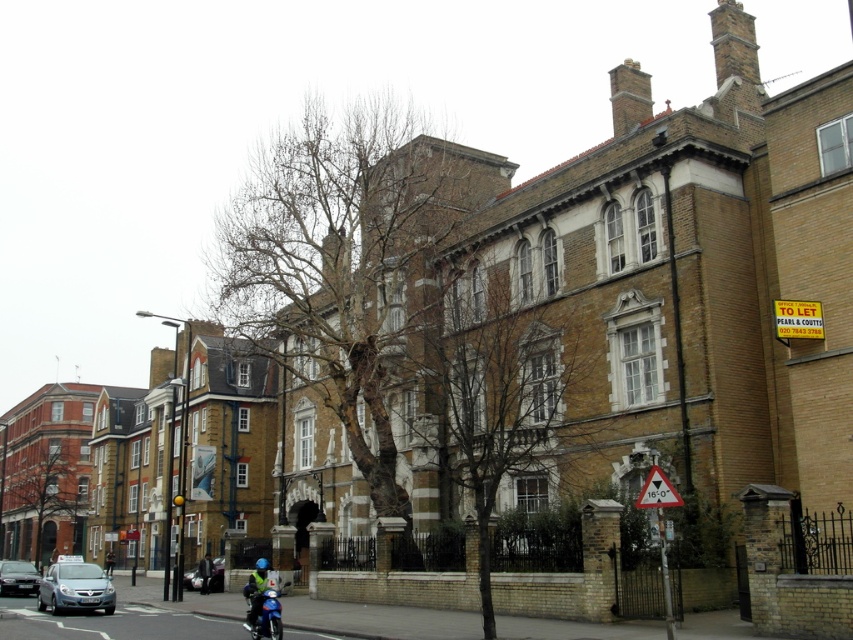
Does metal triangular sign at center have a larger size compared to dark gray suit at center?

No.

Between metal triangular sign at center and dark gray suit at center, which one has more height?

dark gray suit at center is taller.

Which is behind, point (646, 481) or point (201, 576)?

Point (201, 576)

At what (x,y) coordinates should I click in order to perform the action: click on metal triangular sign at center. Please return your answer as a coordinate pair (x, y). Looking at the image, I should click on (657, 490).

Looking at this image, is silver metallic car at lower left closer to camera compared to metal triangular sign at center?

No, it is not.

Can you confirm if silver metallic car at lower left is shorter than metal triangular sign at center?

Incorrect, silver metallic car at lower left's height does not fall short of metal triangular sign at center's.

The height and width of the screenshot is (640, 853). What do you see at coordinates (74, 588) in the screenshot?
I see `silver metallic car at lower left` at bounding box center [74, 588].

I want to click on silver metallic car at lower left, so click(74, 588).

This screenshot has width=853, height=640. What do you see at coordinates (74, 588) in the screenshot? I see `silver metallic car at lower left` at bounding box center [74, 588].

Between silver metallic car at lower left and blue fabric helmet at lower center, which one appears on the right side from the viewer's perspective?

blue fabric helmet at lower center is more to the right.

You are a GUI agent. You are given a task and a screenshot of the screen. Output one action in this format:
    pyautogui.click(x=<x>, y=<y>)
    Task: Click on the silver metallic car at lower left
    The width and height of the screenshot is (853, 640).
    Given the screenshot: What is the action you would take?
    pyautogui.click(x=74, y=588)